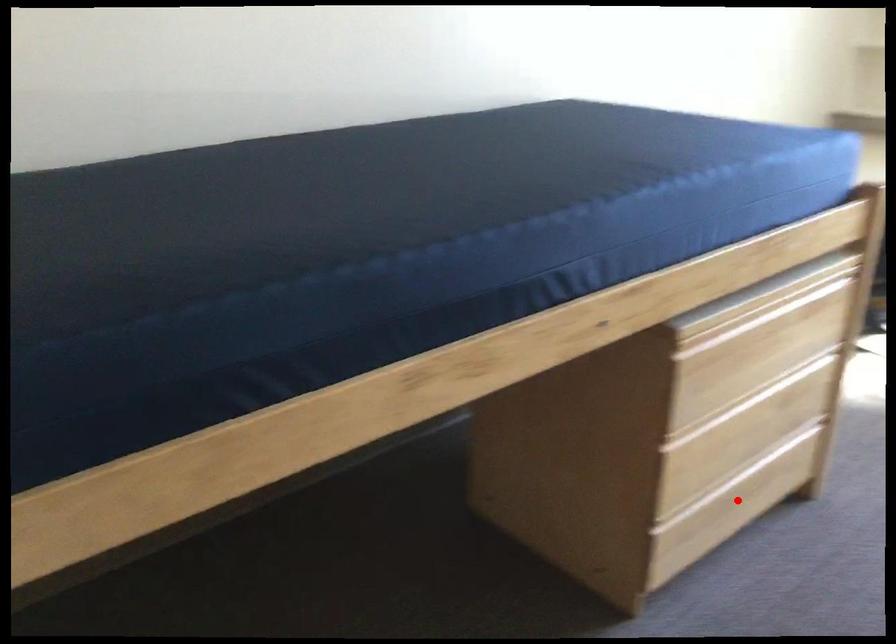
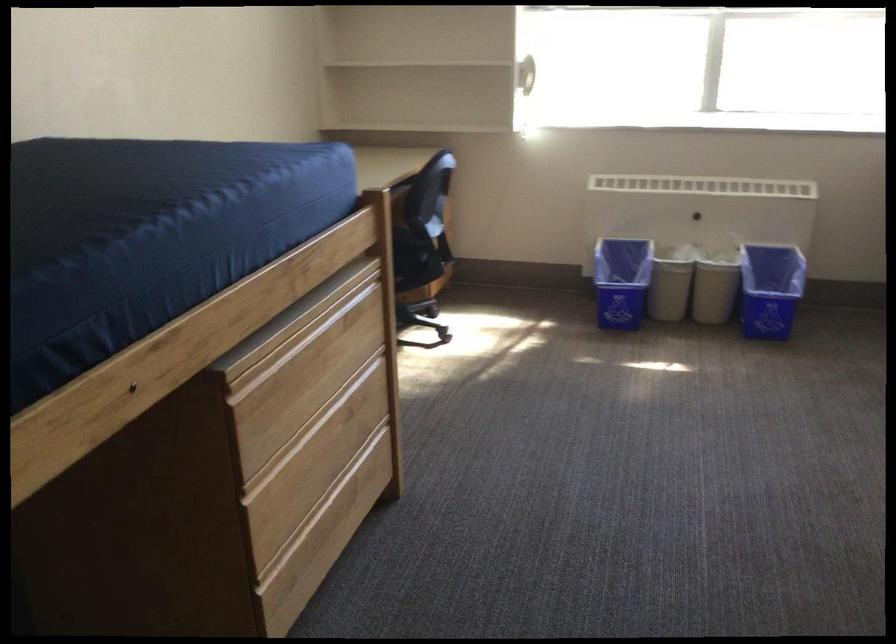
Find the pixel in the second image that matches the highlighted location in the first image.

(330, 523)